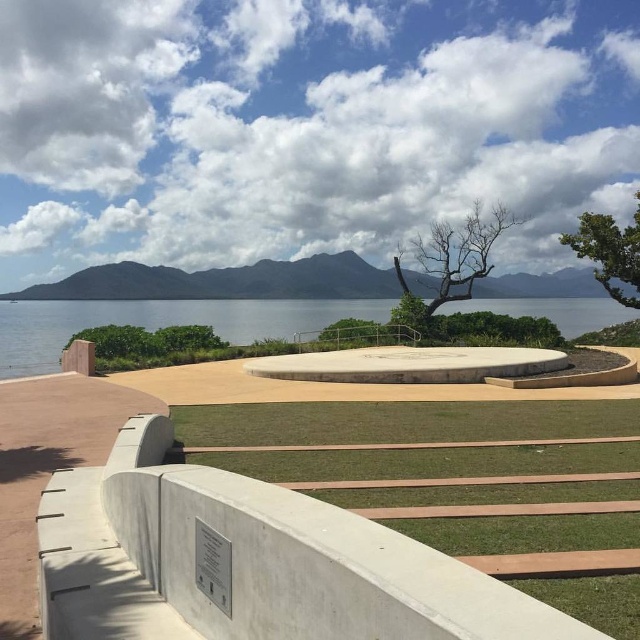
Question: Which object is positioned closest to the clear water at center?

Choices:
 (A) bare wood tree at center
 (B) green leafy tree at upper right

Answer: (A)

Question: Is clear water at center further to camera compared to bare wood tree at center?

Choices:
 (A) no
 (B) yes

Answer: (A)

Question: Is green grass at lower center to the left of clear water at center from the viewer's perspective?

Choices:
 (A) no
 (B) yes

Answer: (A)

Question: Estimate the real-world distances between objects in this image. Which object is farther from the green leafy tree at upper right?

Choices:
 (A) clear water at center
 (B) green grass at lower center
 (C) bare wood tree at center

Answer: (B)

Question: Which of the following is the closest to the observer?

Choices:
 (A) green leafy tree at upper right
 (B) clear water at center
 (C) green grass at lower center
 (D) bare wood tree at center

Answer: (C)

Question: Where is bare wood tree at center located in relation to green leafy tree at upper right in the image?

Choices:
 (A) below
 (B) above

Answer: (A)